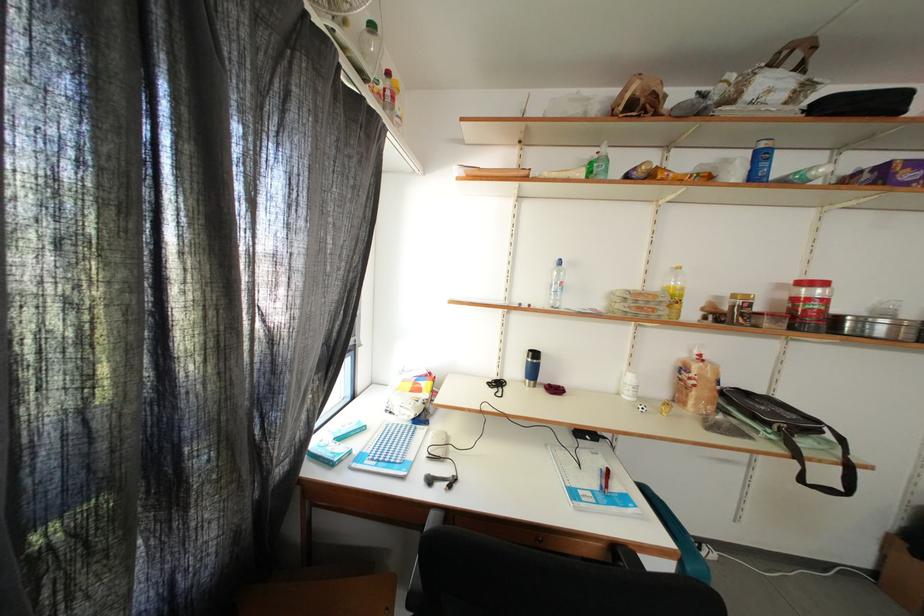
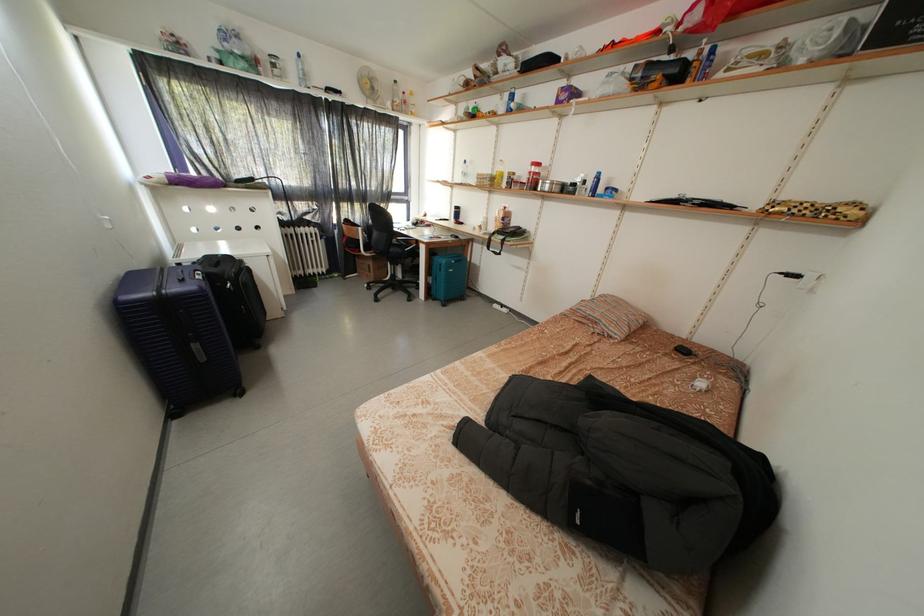
Find the pixel in the second image that matches point (888, 334) in the first image.

(554, 193)